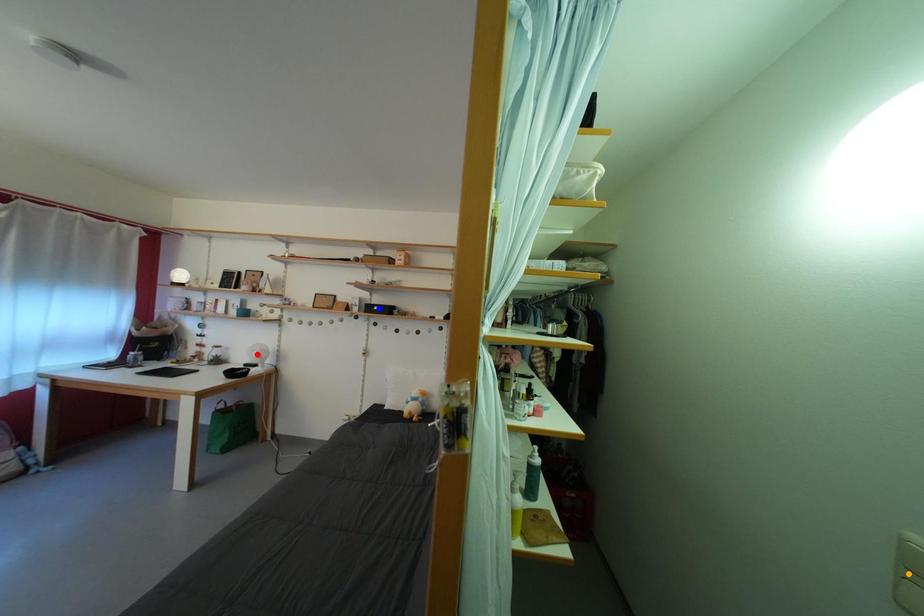
Order these from nearest to farthest:
orange point, red point, blue point

orange point
blue point
red point